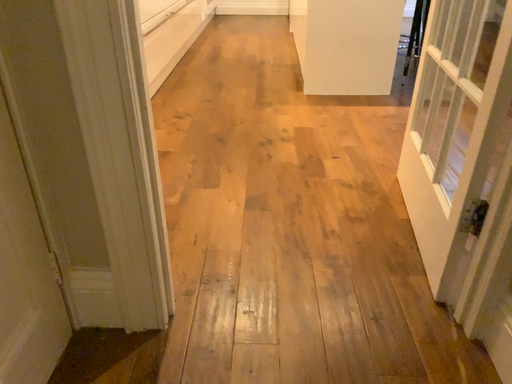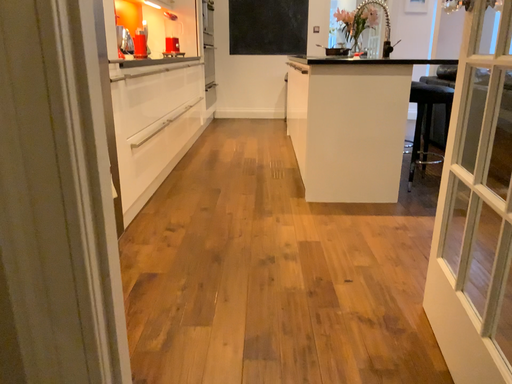
Question: Which way did the camera rotate in the video?

Choices:
 (A) rotated downward
 (B) rotated upward

Answer: (B)